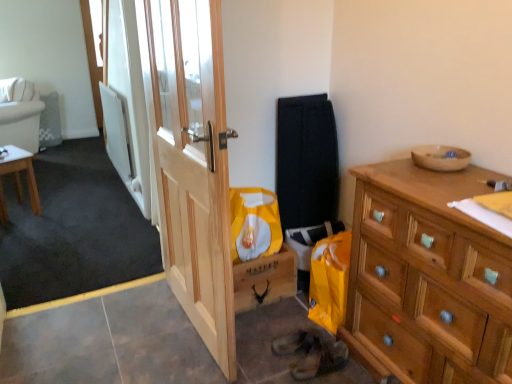
Where is `vacant area that is situated to the right of light brown wooden table at left`? This screenshot has width=512, height=384. vacant area that is situated to the right of light brown wooden table at left is located at coordinates (56, 210).